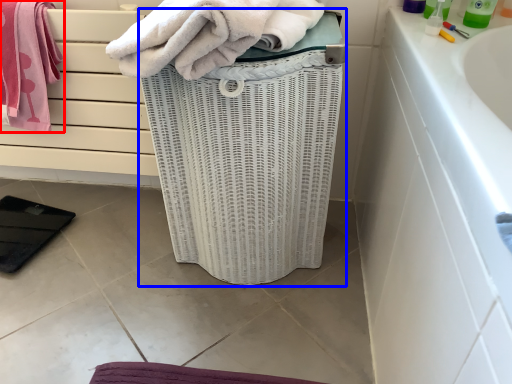
Question: Among these objects, which one is farthest to the camera, towel (highlighted by a red box) or basket container (highlighted by a blue box)?

Choices:
 (A) towel
 (B) basket container

Answer: (A)